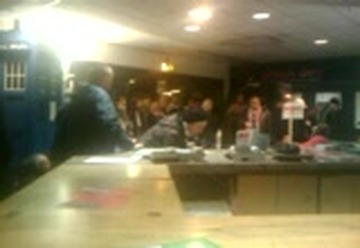
The width and height of the screenshot is (360, 248). I want to click on ceiling vent, so click(265, 38).